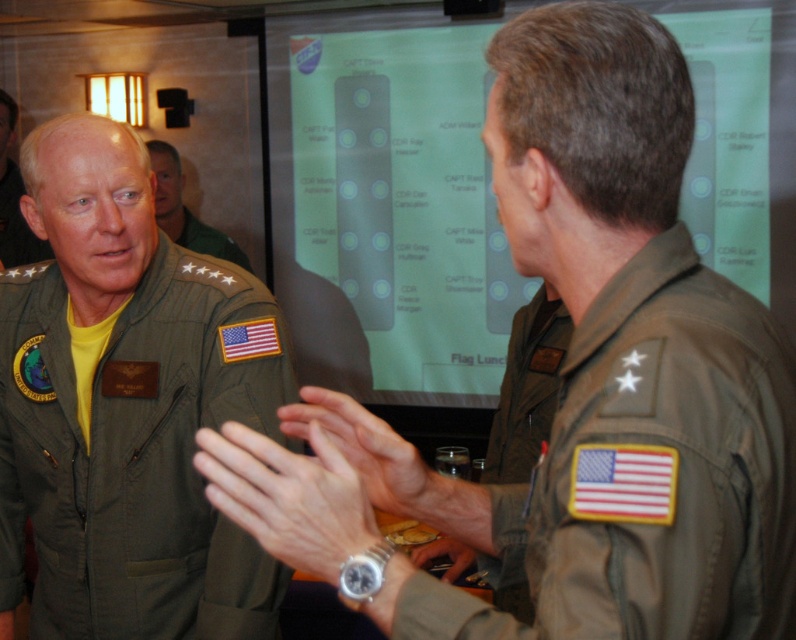
You are standing at a distance of 5 feet from the camera. You want to take a photo of the green fabric uniform at center. Can you step forward to get a better shot without exceeding the 5 feet limit?

The green fabric uniform at center is 4.62 feet away from the camera. Since you are already at 5 feet from the camera, stepping forward would bring you closer than 5 feet, which exceeds the limit. Therefore, you cannot step forward without violating the distance restriction.

Based on the photo, you are attending a military briefing and notice two items of interest in the scene. The first is the green uniform at left, and the second is the metallic wristwatch at center. Based on their positions, which item is closer to the left side of the image?

The green uniform at left is closer to the left side of the image because it is positioned to the left of the metallic wristwatch at center.

Consider the image. You are a photographer standing at a distance of 5 feet from the green fabric uniform at center. Can you take a clear photo of it without moving closer?

The green fabric uniform at center is 4.62 feet away from the camera, which is within your current distance of 5 feet. Therefore, you can take a clear photo without moving closer.